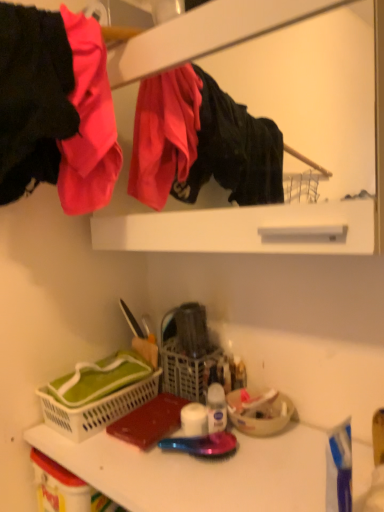
Locate an element on the screen. Image resolution: width=384 pixels, height=512 pixels. vacant space situated on the left part of white matte toilet paper at center is located at coordinates (109, 451).